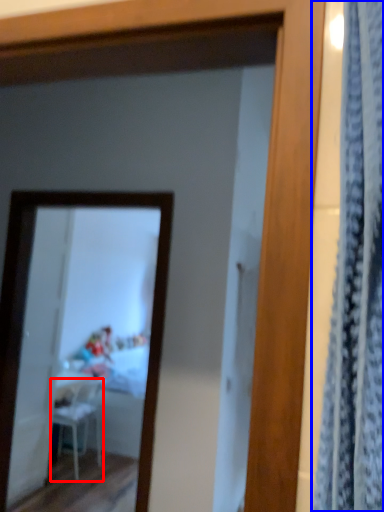
Question: Among these objects, which one is farthest to the camera, chair (highlighted by a red box) or curtain (highlighted by a blue box)?

Choices:
 (A) chair
 (B) curtain

Answer: (A)